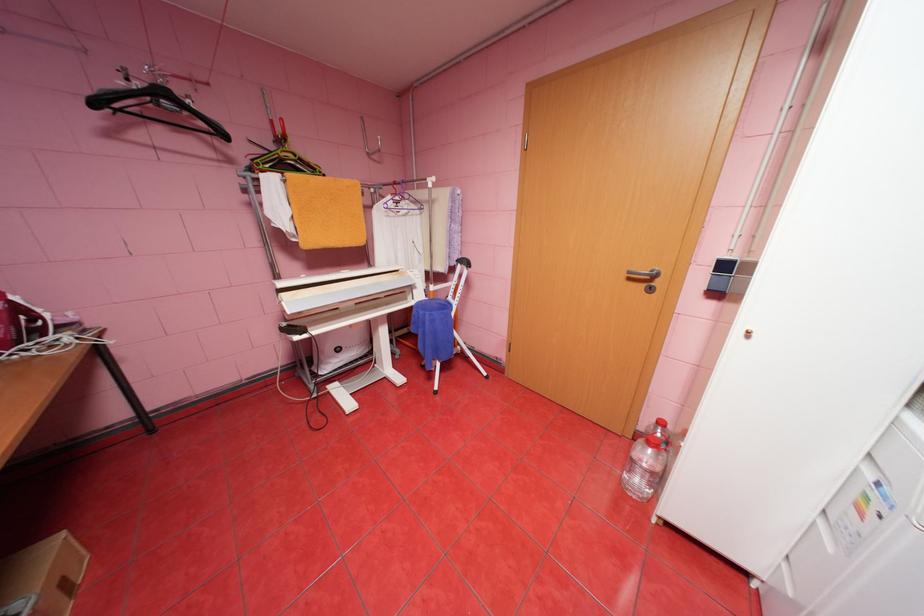
Where would you lift the plastic water bottle? Please return your answer as a coordinate pair (x, y).

(645, 467)